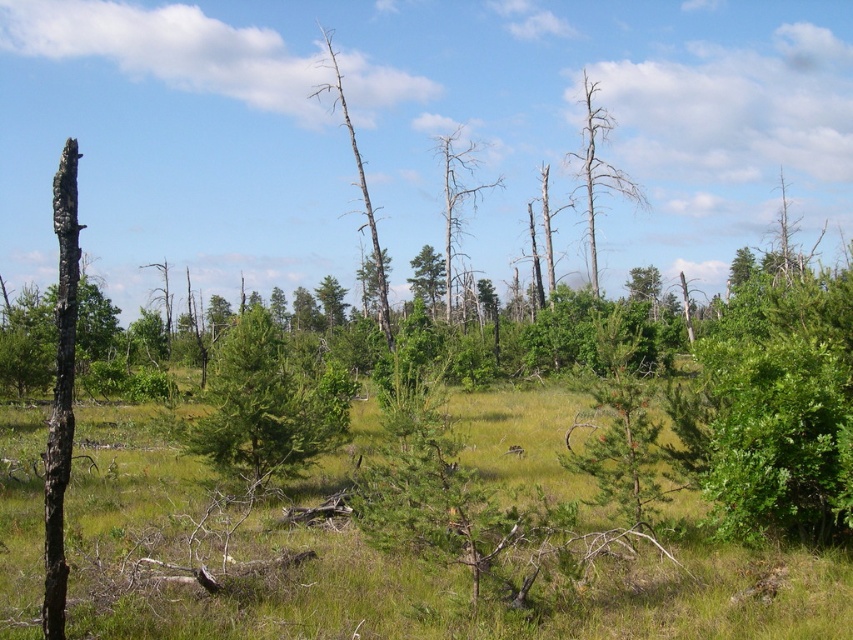
Does green matte tree at center have a smaller size compared to bare wood tree at center?

Correct, green matte tree at center occupies less space than bare wood tree at center.

Consider the image. Is green matte tree at center shorter than bare wood tree at center?

Indeed, green matte tree at center has a lesser height compared to bare wood tree at center.

Does point (250, 467) lie in front of point (321, 28)?

Yes, it is in front of point (321, 28).

This screenshot has height=640, width=853. In order to click on green matte tree at center in this screenshot , I will do `click(265, 406)`.

Does dead wood tree at upper right have a smaller size compared to dead wood tree at center?

→ Actually, dead wood tree at upper right might be larger than dead wood tree at center.

At what (x,y) coordinates should I click in order to perform the action: click on dead wood tree at upper right. Please return your answer as a coordinate pair (x, y). This screenshot has width=853, height=640. Looking at the image, I should click on (598, 170).

I want to click on dead wood tree at upper right, so click(x=598, y=170).

Does green matte tree at center appear under dead wood tree at upper right?

Indeed, green matte tree at center is positioned under dead wood tree at upper right.

Consider the image. Does green matte tree at center appear on the right side of dead wood tree at upper right?

In fact, green matte tree at center is to the left of dead wood tree at upper right.

Find the location of a particular element. The width and height of the screenshot is (853, 640). green matte tree at center is located at coordinates (265, 406).